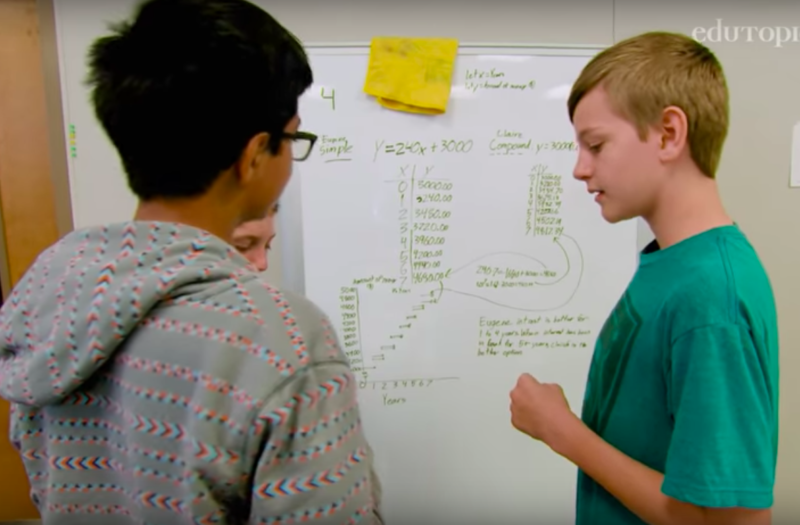
Find the location of a particular element. whiteboard is located at coordinates (528, 111).